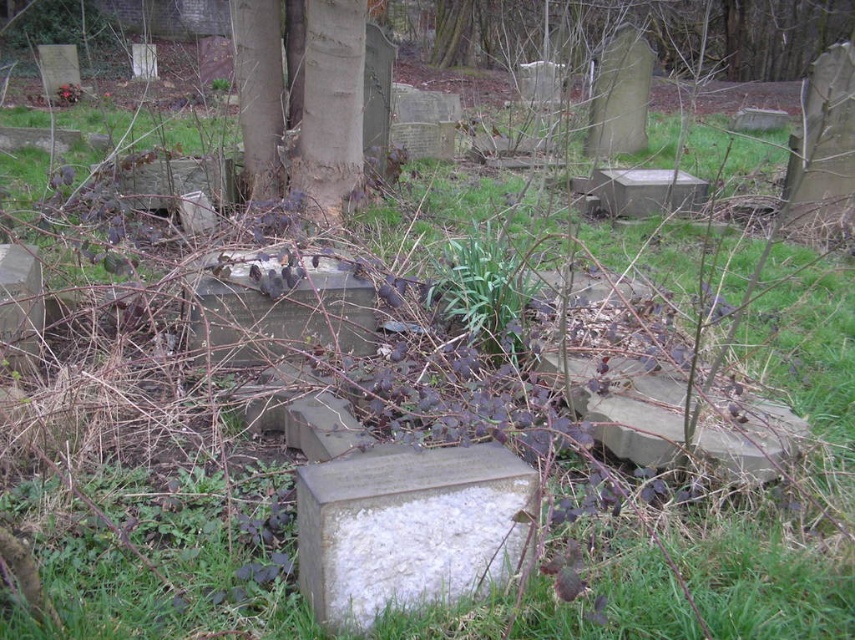
Does point (429, 595) come farther from viewer compared to point (452, 10)?

No, it is not.

Is white stone gravestone at center below smooth bark tree at upper center?

Correct, white stone gravestone at center is located below smooth bark tree at upper center.

Where is `white stone gravestone at center`? The height and width of the screenshot is (640, 855). white stone gravestone at center is located at coordinates (408, 529).

At what (x,y) coordinates should I click in order to perform the action: click on white stone gravestone at center. Please return your answer as a coordinate pair (x, y). Looking at the image, I should click on (408, 529).

Can you confirm if smooth bark tree at upper center is wider than gray stone gravestone at center?

Yes, smooth bark tree at upper center is wider than gray stone gravestone at center.

Between smooth bark tree at upper center and gray stone gravestone at center, which one is positioned higher?

smooth bark tree at upper center

At what (x,y) coordinates should I click in order to perform the action: click on smooth bark tree at upper center. Please return your answer as a coordinate pair (x, y). This screenshot has width=855, height=640. Looking at the image, I should click on coord(628,22).

The height and width of the screenshot is (640, 855). In order to click on smooth bark tree at upper center in this screenshot , I will do `click(628, 22)`.

Between point (428, 0) and point (228, 336), which one is positioned behind?

Positioned behind is point (428, 0).

Does point (506, 45) come farther from viewer compared to point (198, 278)?

Yes.

Locate an element on the screen. smooth bark tree at upper center is located at coordinates (628, 22).